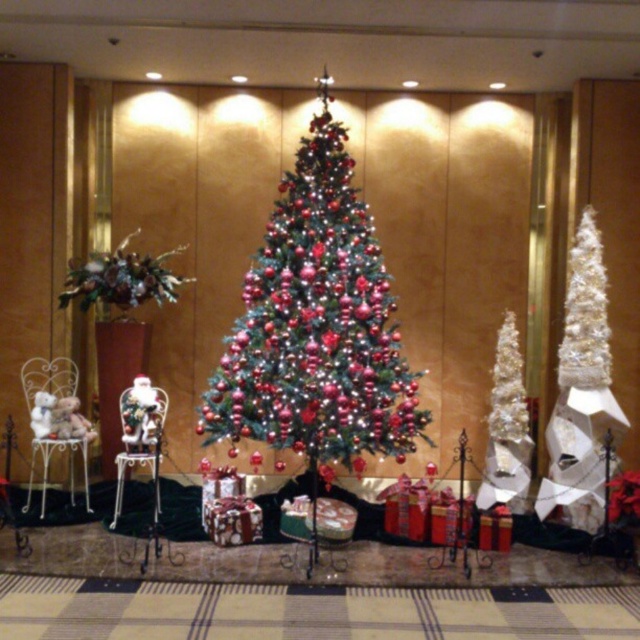
Does point (86, 506) lie in front of point (125, 433)?

No, (86, 506) is further to viewer.

Describe the element at coordinates (51, 422) in the screenshot. I see `white metal chair at left` at that location.

Identify the location of white metal chair at left. This screenshot has height=640, width=640. (51, 422).

Who is higher up, shiny green christmas tree at center or white metal chair at left?

shiny green christmas tree at center is above.

Does shiny green christmas tree at center have a larger size compared to white metal chair at left?

Yes, shiny green christmas tree at center is bigger than white metal chair at left.

Between point (216, 387) and point (49, 420), which one is positioned in front?

Point (216, 387)

Where is `shiny green christmas tree at center`? The image size is (640, 640). shiny green christmas tree at center is located at coordinates (316, 326).

Measure the distance between white metallic chair at left and camera.

A distance of 4.08 meters exists between white metallic chair at left and camera.

Between white metallic chair at left and white glittery christmas tree at right, which one is positioned higher?

white glittery christmas tree at right

What do you see at coordinates (138, 433) in the screenshot? This screenshot has width=640, height=640. I see `white metallic chair at left` at bounding box center [138, 433].

At what (x,y) coordinates should I click in order to perform the action: click on white metallic chair at left. Please return your answer as a coordinate pair (x, y). This screenshot has height=640, width=640. Looking at the image, I should click on (138, 433).